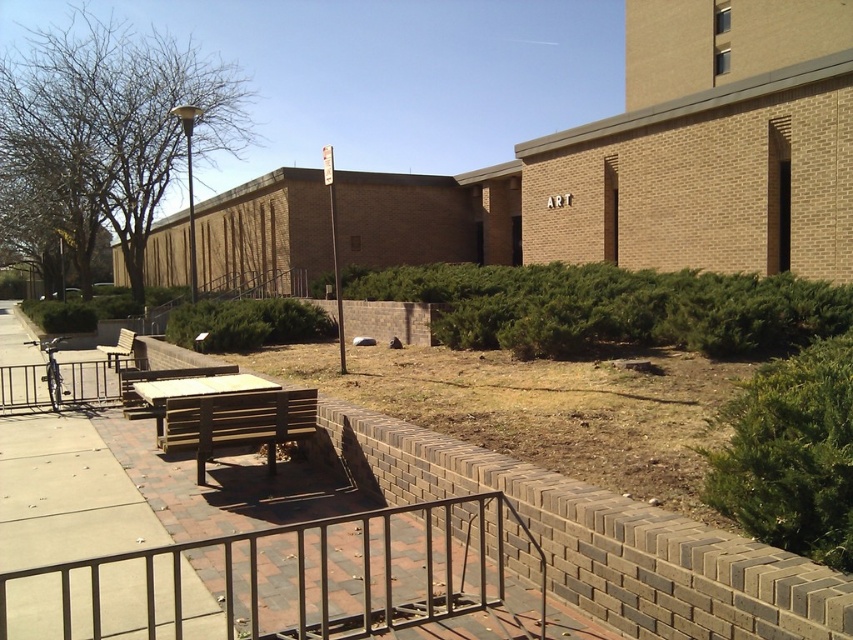
You are planning to place a new plant pot in the outdoor scene. The plant pot is 1 meter in height. You want to place it near the metal at lower center and the wooden park bench at left. Which object should you place it closer to if you want the plant pot to be taller than the object it is placed next to?

The metal at lower center has a smaller size compared to wooden park bench at left. Therefore, placing the plant pot next to the metal at lower center ensures the plant pot will be taller than the object it is placed next to.

You are standing on the paved area and want to sit down. The wooden park bench at center is your target. To reach it, should you walk towards the right or left of the metallic silver railing at left?

Since the metallic silver railing at left is to the left of the wooden park bench at center, you should walk to the right of the metallic silver railing at left to reach the wooden park bench at center.